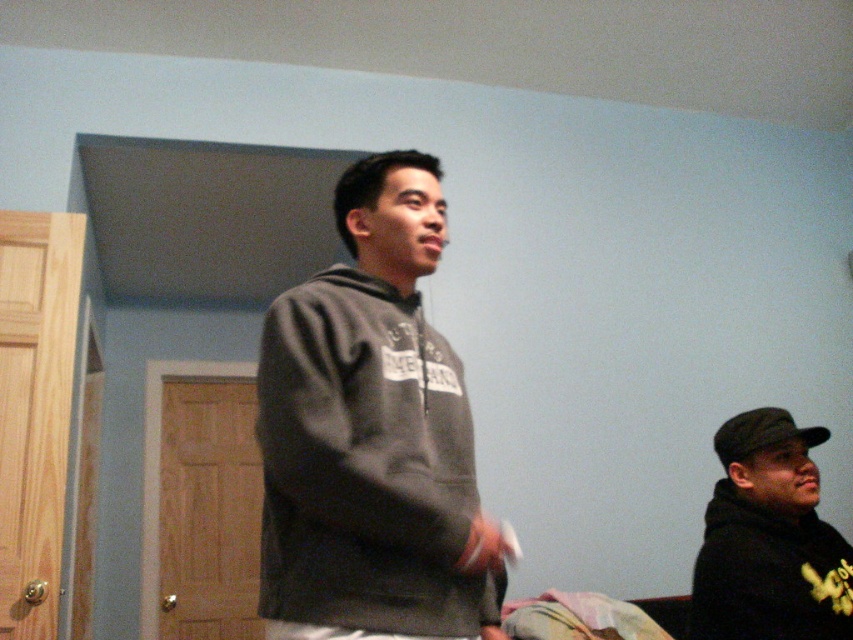
Question: Can you confirm if dark gray hoodie at center is smaller than black matte hoodie at lower right?

Choices:
 (A) yes
 (B) no

Answer: (B)

Question: Which point is closer to the camera?

Choices:
 (A) dark gray hoodie at center
 (B) black matte hoodie at lower right

Answer: (A)

Question: Among these objects, which one is farthest from the camera?

Choices:
 (A) black matte hoodie at lower right
 (B) dark gray hoodie at center

Answer: (A)

Question: Among these points, which one is nearest to the camera?

Choices:
 (A) (306, 596)
 (B) (844, 588)

Answer: (A)

Question: Is dark gray hoodie at center thinner than black matte hoodie at lower right?

Choices:
 (A) no
 (B) yes

Answer: (B)

Question: Can you confirm if dark gray hoodie at center is bigger than black matte hoodie at lower right?

Choices:
 (A) yes
 (B) no

Answer: (A)